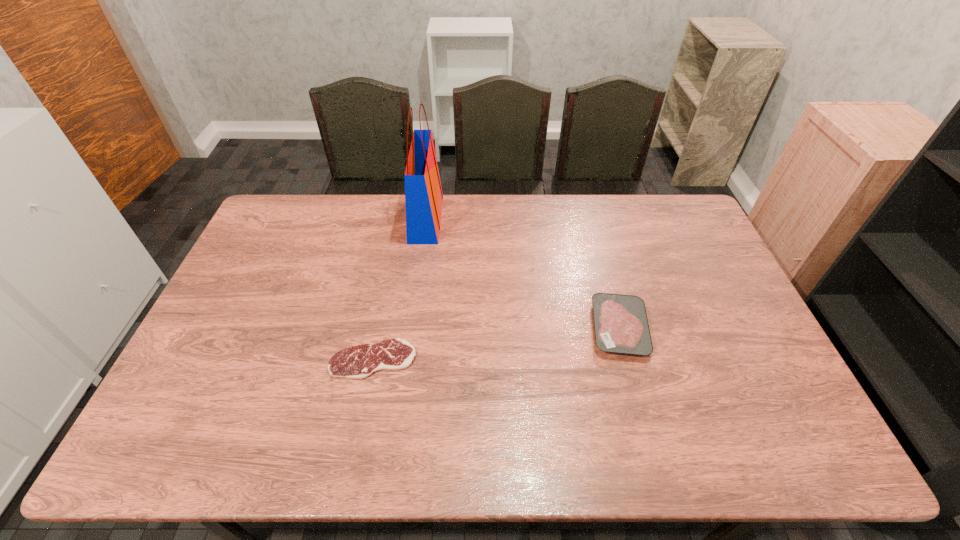
Locate an element on the screen. vacant area in the image that satisfies the following two spatial constraints: 1. on the handle side of the tallest object; 2. on the left side of the right steak is located at coordinates (412, 328).

Locate an element on the screen. vacant space that satisfies the following two spatial constraints: 1. on the back side of the right steak; 2. on the handle side of the farthest object is located at coordinates (589, 219).